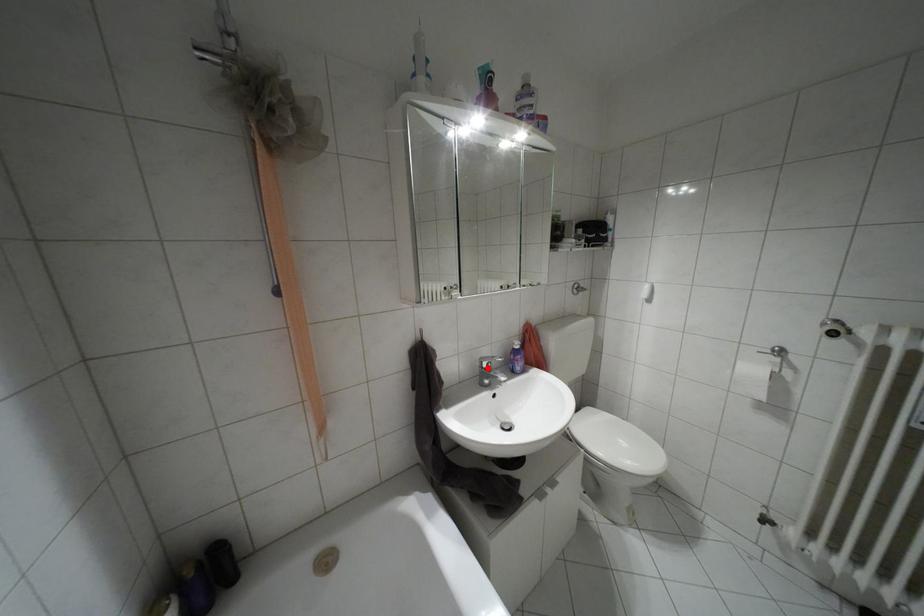
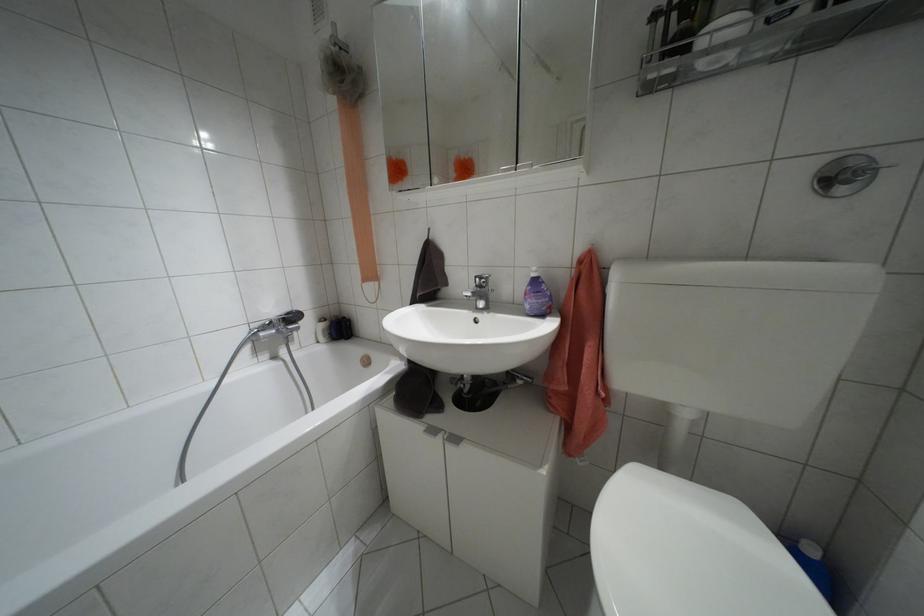
Locate, in the second image, the point that corresponds to the highlighted location in the first image.

(479, 286)